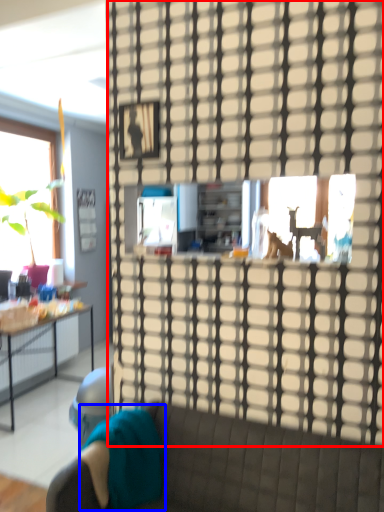
Question: Among these objects, which one is farthest to the camera, glass door (highlighted by a red box) or pillow (highlighted by a blue box)?

Choices:
 (A) glass door
 (B) pillow

Answer: (B)